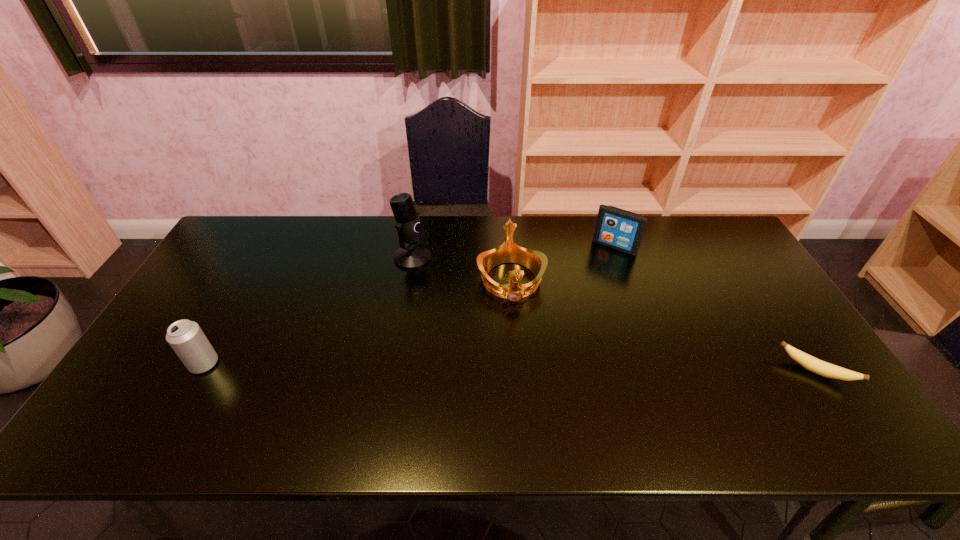
You are a GUI agent. You are given a task and a screenshot of the screen. Output one action in this format:
    pyautogui.click(x=<x>, y=<y>)
    Task: Click on the object that can be found as the fourth closest to the banana
    The image size is (960, 540).
    Given the screenshot: What is the action you would take?
    pyautogui.click(x=186, y=338)

Find the location of a particular element. Image resolution: width=960 pixels, height=540 pixels. object identified as the closest to the third object from right to left is located at coordinates (410, 230).

Where is `vacant space that satisfies the following two spatial constraints: 1. on the front side of the shortest object; 2. on the right side of the third object from right to left`? The image size is (960, 540). vacant space that satisfies the following two spatial constraints: 1. on the front side of the shortest object; 2. on the right side of the third object from right to left is located at coordinates (517, 371).

Where is `free space that satisfies the following two spatial constraints: 1. on the front side of the third object from left to right; 2. on the left side of the shortest object`? Image resolution: width=960 pixels, height=540 pixels. free space that satisfies the following two spatial constraints: 1. on the front side of the third object from left to right; 2. on the left side of the shortest object is located at coordinates (517, 371).

I want to click on vacant position in the image that satisfies the following two spatial constraints: 1. on the back side of the iPod; 2. on the left side of the beer can, so click(x=269, y=247).

This screenshot has width=960, height=540. I want to click on blank space that satisfies the following two spatial constraints: 1. on the back side of the beer can; 2. on the left side of the iPod, so click(269, 247).

The image size is (960, 540). I want to click on free point that satisfies the following two spatial constraints: 1. on the back side of the second object from right to left; 2. on the left side of the tallest object, so click(414, 247).